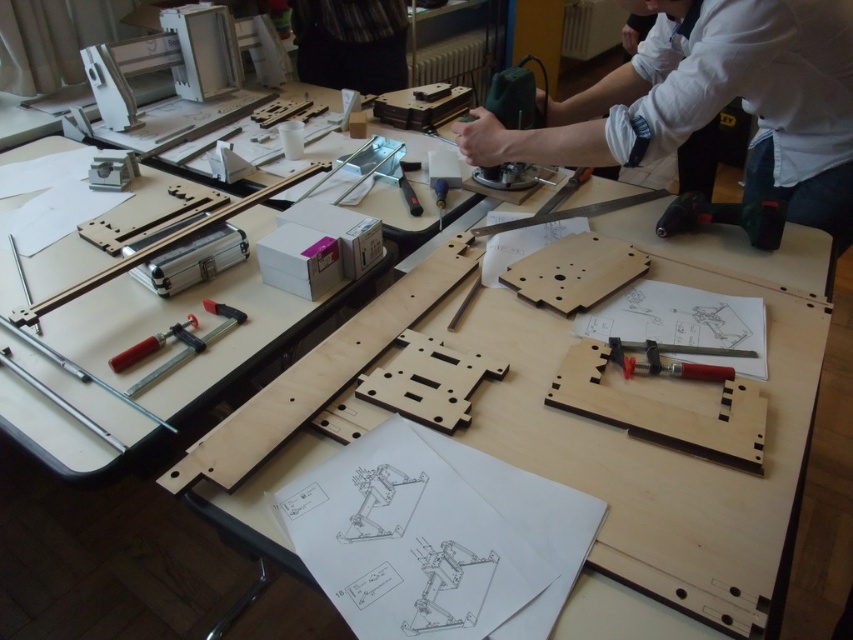
Which is below, green plastic drill at center-right or red plastic clamp at center-left?

red plastic clamp at center-left is lower down.

Between green plastic drill at center-right and red plastic clamp at center-left, which one appears on the right side from the viewer's perspective?

From the viewer's perspective, green plastic drill at center-right appears more on the right side.

Is point (677, 230) closer to viewer compared to point (122, 365)?

No.

You are a GUI agent. You are given a task and a screenshot of the screen. Output one action in this format:
    pyautogui.click(x=<x>, y=<y>)
    Task: Click on the green plastic drill at center-right
    This screenshot has height=640, width=853.
    Given the screenshot: What is the action you would take?
    pyautogui.click(x=724, y=218)

You are a GUI agent. You are given a task and a screenshot of the screen. Output one action in this format:
    pyautogui.click(x=<x>, y=<y>)
    Task: Click on the red plastic clamp at center
    The image size is (853, 640).
    Given the screenshot: What is the action you would take?
    177,340

Between point (178, 323) and point (175, 332), which one is positioned behind?

The point (178, 323) is more distant.

Describe the element at coordinates (177, 340) in the screenshot. I see `red plastic clamp at center` at that location.

You are a GUI agent. You are given a task and a screenshot of the screen. Output one action in this format:
    pyautogui.click(x=<x>, y=<y>)
    Task: Click on the red plastic clamp at center
    This screenshot has width=853, height=640.
    Given the screenshot: What is the action you would take?
    pyautogui.click(x=177, y=340)

Which of these two, white shirt at upper right or black fabric at upper center, stands taller?

Standing taller between the two is white shirt at upper right.

Between point (817, 42) and point (401, 40), which one is positioned behind?

The point (401, 40) is behind.

This screenshot has height=640, width=853. What do you see at coordinates (714, 100) in the screenshot?
I see `white shirt at upper right` at bounding box center [714, 100].

Find the location of a particular element. This screenshot has width=853, height=640. white shirt at upper right is located at coordinates (714, 100).